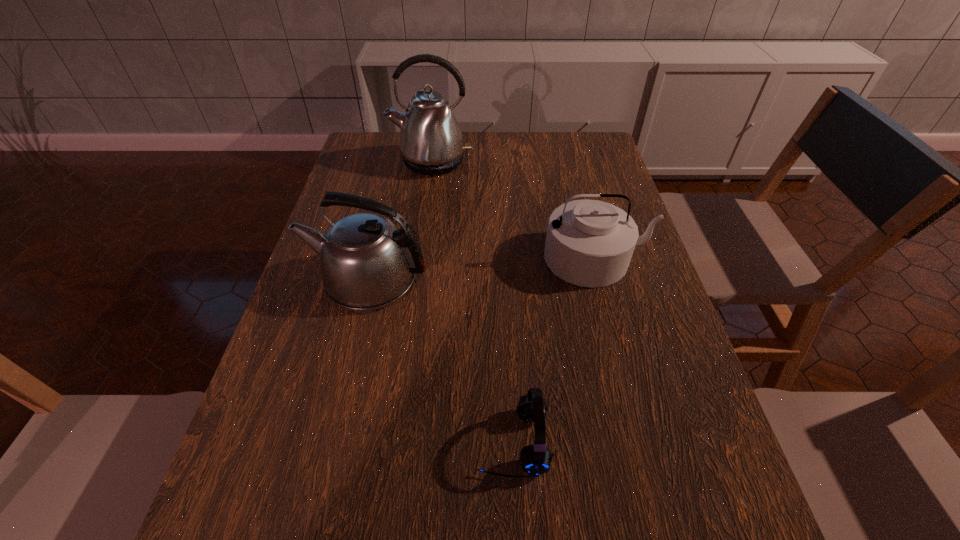
You are a GUI agent. You are given a task and a screenshot of the screen. Output one action in this format:
    pyautogui.click(x=<x>, y=<y>)
    Task: Click on the tallest object
    
    Given the screenshot: What is the action you would take?
    pyautogui.click(x=431, y=143)

You are a GUI agent. You are given a task and a screenshot of the screen. Output one action in this format:
    pyautogui.click(x=<x>, y=<y>)
    Task: Click on the farthest kettle
    
    Given the screenshot: What is the action you would take?
    pyautogui.click(x=431, y=143)

At what (x,y) coordinates should I click in order to perform the action: click on the second tallest object. Please return your answer as a coordinate pair (x, y). This screenshot has width=960, height=540. Looking at the image, I should click on (366, 262).

This screenshot has height=540, width=960. I want to click on the second shortest object, so click(589, 243).

Find the location of `the rightmost object`. the rightmost object is located at coordinates (589, 243).

Image resolution: width=960 pixels, height=540 pixels. I want to click on the nearest object, so click(x=535, y=459).

Find the location of `the shortest object`. the shortest object is located at coordinates (535, 459).

At what (x,y) coordinates should I click in order to perform the action: click on vacant area located on the right of the farthest object. Please return your answer as a coordinate pair (x, y). Looking at the image, I should click on (530, 162).

Locate an element on the screen. free space located on the spout of the rightmost kettle is located at coordinates (629, 381).

Locate an element on the screen. This screenshot has width=960, height=540. vacant space located on the ear cushions of the second object from right to left is located at coordinates (404, 442).